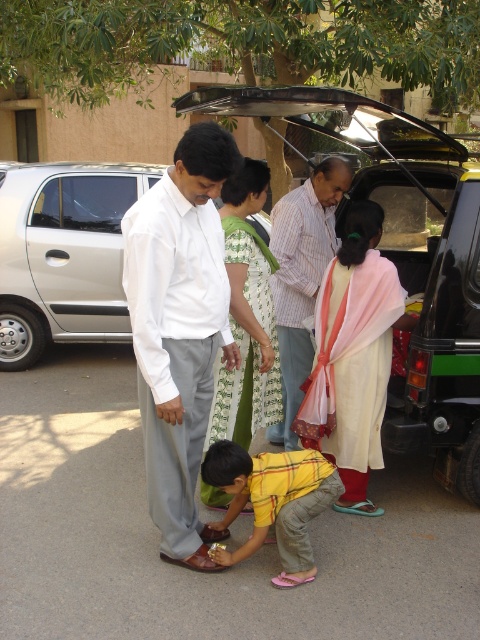
Can you confirm if silver metallic car at left is bigger than white cotton saree at center?

Indeed, silver metallic car at left has a larger size compared to white cotton saree at center.

Does point (58, 212) lie behind point (388, 321)?

Yes, it is behind point (388, 321).

At what (x,y) coordinates should I click in order to perform the action: click on silver metallic car at left. Please return your answer as a coordinate pair (x, y). Looking at the image, I should click on (63, 253).

Is yellow cotton shirt at center to the right of green floral dress at center from the viewer's perspective?

No, yellow cotton shirt at center is not to the right of green floral dress at center.

Does yellow cotton shirt at center have a greater height compared to green floral dress at center?

Correct, yellow cotton shirt at center is much taller as green floral dress at center.

Between point (151, 294) and point (261, 401), which one is positioned behind?

Positioned behind is point (261, 401).

The width and height of the screenshot is (480, 640). In order to click on yellow cotton shirt at center in this screenshot , I will do [x=180, y=326].

Can you confirm if white smooth shirt at center is positioned to the left of silver metallic car at left?

Incorrect, white smooth shirt at center is not on the left side of silver metallic car at left.

This screenshot has height=640, width=480. In order to click on white smooth shirt at center in this screenshot , I will do `click(180, 330)`.